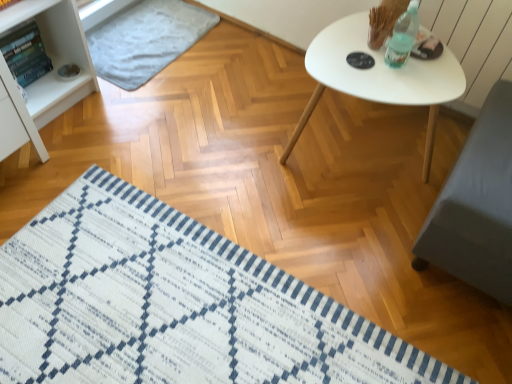
Locate an element on the screen. This screenshot has height=384, width=512. empty space that is in between white matte table at upper right and white woven mat at lower left, which ranks as the first mat in bottom-to-top order is located at coordinates (307, 208).